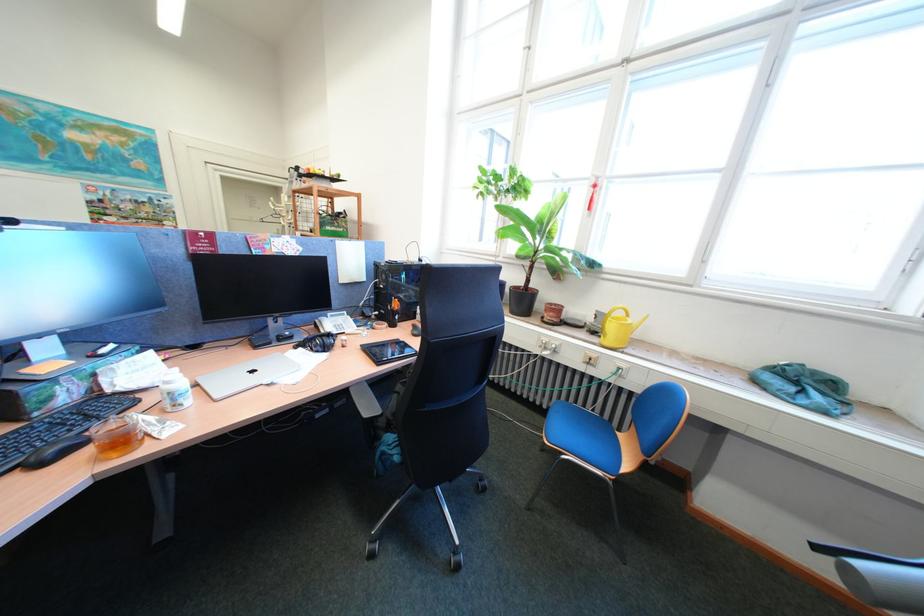
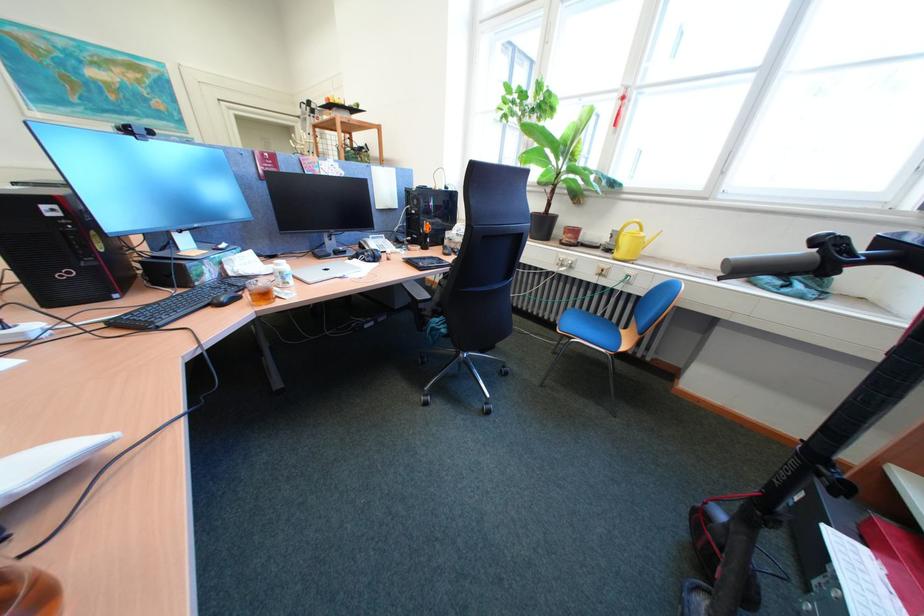
Question: Based on the continuous images, in which direction is the camera rotating? Reply with the corresponding letter.

Choices:
 (A) Left
 (B) Right
 (C) Up
 (D) Down

Answer: (D)